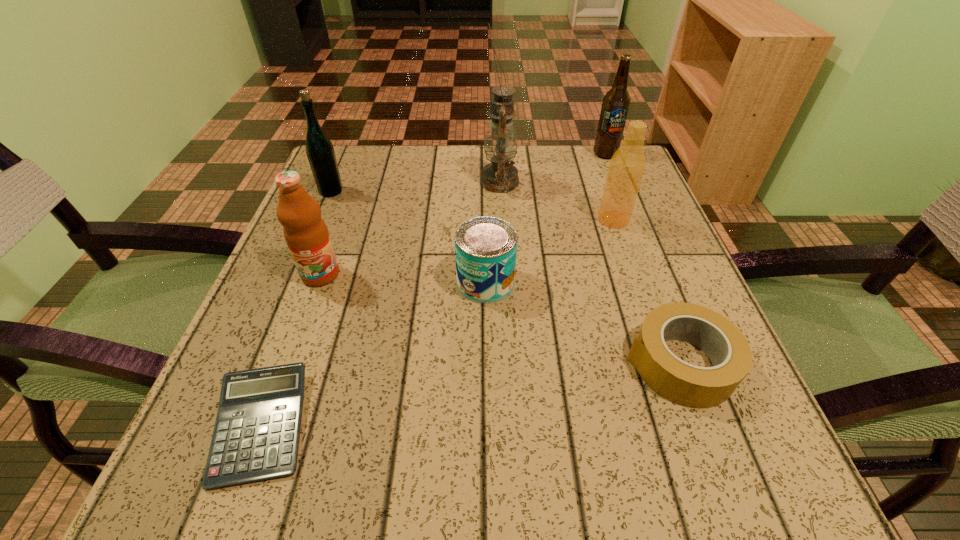
Identify the location of beer bottle located at the left edge. (320, 152).

Identify the location of fruit juice at the left edge. (306, 234).

This screenshot has height=540, width=960. I want to click on calculator that is positioned at the left edge, so click(x=256, y=435).

This screenshot has height=540, width=960. Find the location of `duct tape at the right edge`. duct tape at the right edge is located at coordinates (685, 384).

The image size is (960, 540). Find the location of `object positioned at the far left corner`. object positioned at the far left corner is located at coordinates (320, 152).

I want to click on object at the near left corner, so click(x=256, y=435).

Identify the location of object present at the far right corner. The image size is (960, 540). point(616,102).

Locate an element on the screen. This screenshot has width=960, height=540. free space at the far edge of the desktop is located at coordinates (478, 147).

What are the coordinates of `free space at the near edge of the desktop` in the screenshot? It's located at (601, 478).

The width and height of the screenshot is (960, 540). Find the location of `free space at the left edge of the desktop`. free space at the left edge of the desktop is located at coordinates (355, 306).